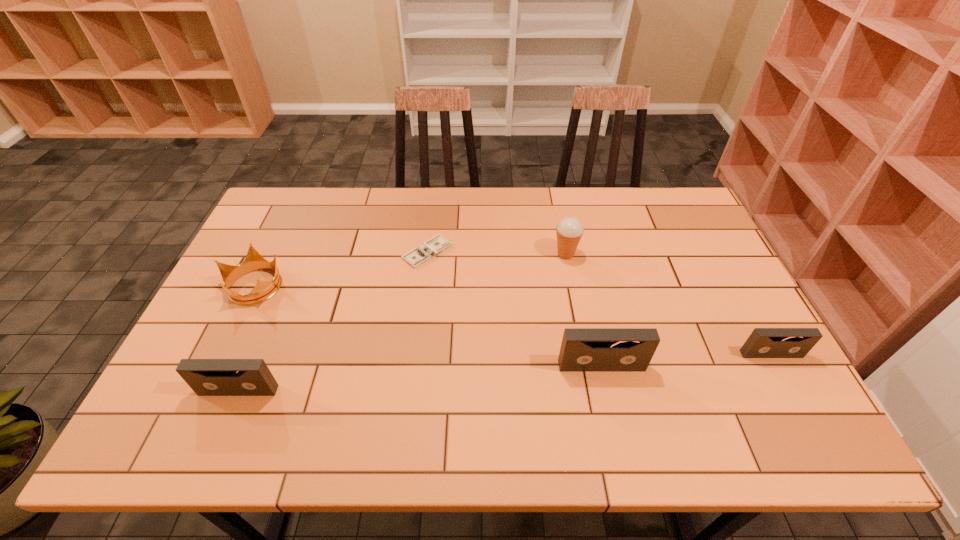
What are the coordinates of `free space between the second tallest videotape and the second nearest object` in the screenshot? It's located at (420, 378).

Find the location of a particular element. Image resolution: width=960 pixels, height=540 pixels. free point between the crown and the nearest object is located at coordinates (247, 338).

Identify the location of free space between the nearest videotape and the second farthest videotape. (420, 378).

This screenshot has height=540, width=960. Identify the location of the second closest object relative to the crown. (423, 253).

Identify which object is located as the third nearest to the shortest videotape. Please provide its 2D coordinates. Your answer should be formatted as a tuple, i.e. [(x, y)], where the tuple contains the x and y coordinates of a point satisfying the conditions above.

[(423, 253)]

Identify which videotape is located as the third nearest to the crown. Please provide its 2D coordinates. Your answer should be formatted as a tuple, i.e. [(x, y)], where the tuple contains the x and y coordinates of a point satisfying the conditions above.

[(763, 342)]

Locate which videotape is the closest to the second videotape from right to left. Please provide its 2D coordinates. Your answer should be formatted as a tuple, i.e. [(x, y)], where the tuple contains the x and y coordinates of a point satisfying the conditions above.

[(763, 342)]